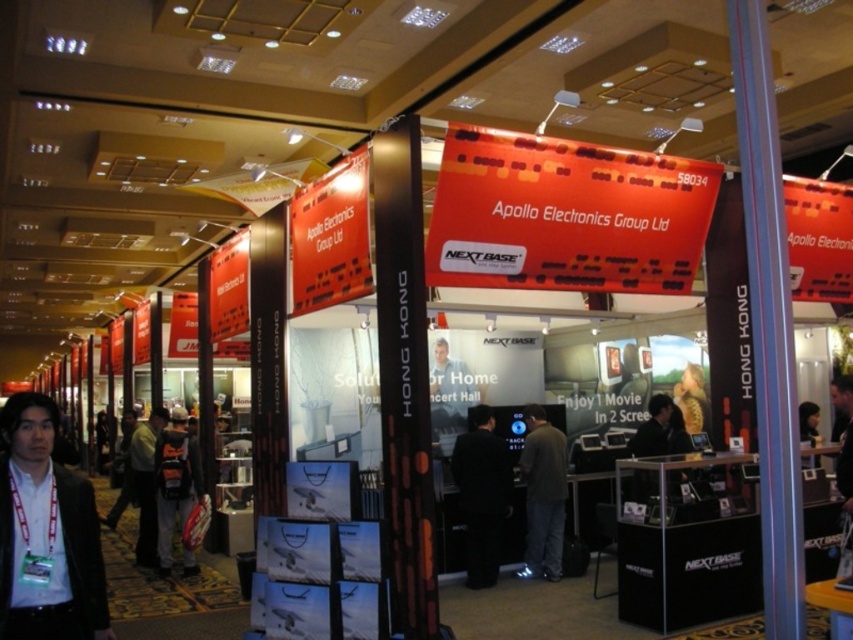
Is orange fabric backpack at center shorter than dark gray suit at center?

Indeed, orange fabric backpack at center has a lesser height compared to dark gray suit at center.

Is point (163, 568) positioned before point (158, 429)?

That is True.

This screenshot has height=640, width=853. I want to click on orange fabric backpack at center, so click(175, 483).

Where is `orange fabric backpack at center`? Image resolution: width=853 pixels, height=640 pixels. orange fabric backpack at center is located at coordinates (175, 483).

Can you confirm if dark gray fabric jacket at center is bigger than dark gray suit at center?

Actually, dark gray fabric jacket at center might be smaller than dark gray suit at center.

Is dark gray fabric jacket at center thinner than dark gray suit at center?

Yes.

Which is in front, point (529, 541) or point (142, 496)?

Point (529, 541)

The height and width of the screenshot is (640, 853). Find the location of `dark gray fabric jacket at center`. dark gray fabric jacket at center is located at coordinates (543, 496).

Is point (35, 589) farther from viewer compared to point (511, 509)?

No, (35, 589) is in front of (511, 509).

Image resolution: width=853 pixels, height=640 pixels. What do you see at coordinates (45, 532) in the screenshot? I see `matte black suit at lower left` at bounding box center [45, 532].

Is point (71, 499) positioned in front of point (482, 545)?

Yes, point (71, 499) is closer to viewer.

This screenshot has height=640, width=853. Identify the location of matte black suit at lower left. (45, 532).